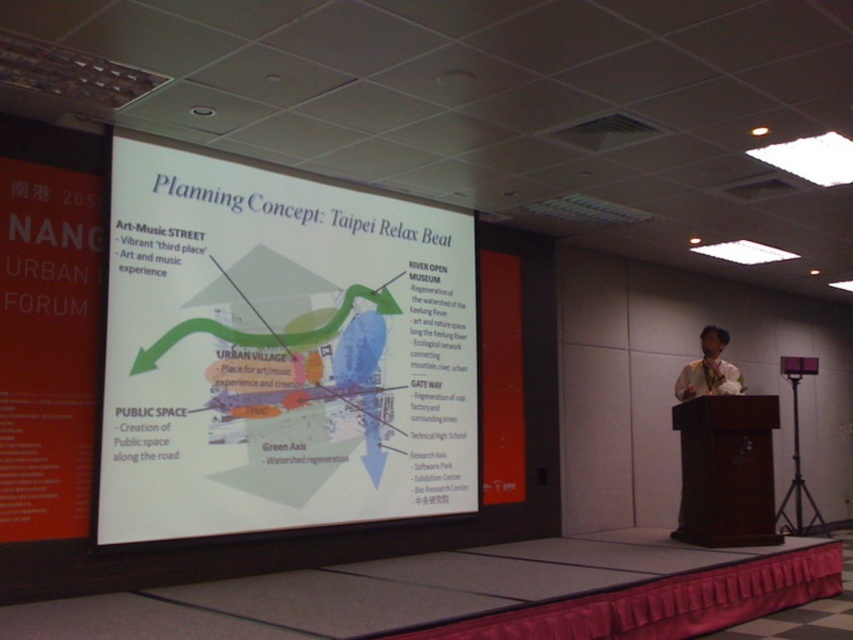
Question: Which point is farther to the camera?

Choices:
 (A) pos(723,413)
 (B) pos(158,317)

Answer: (A)

Question: Is white paper at center closer to camera compared to brown wooden podium at right?

Choices:
 (A) yes
 (B) no

Answer: (A)

Question: Which point appears farthest from the camera in this image?

Choices:
 (A) (751, 435)
 (B) (350, 208)
 (C) (706, 372)

Answer: (C)

Question: Estimate the real-world distances between objects in this image. Which object is closer to the white paper at center?

Choices:
 (A) matte white shirt at right
 (B) brown wooden podium at right

Answer: (B)

Question: Is white paper at center smaller than matte white shirt at right?

Choices:
 (A) no
 (B) yes

Answer: (A)

Question: Does brown wooden podium at right have a larger size compared to matte white shirt at right?

Choices:
 (A) no
 (B) yes

Answer: (B)